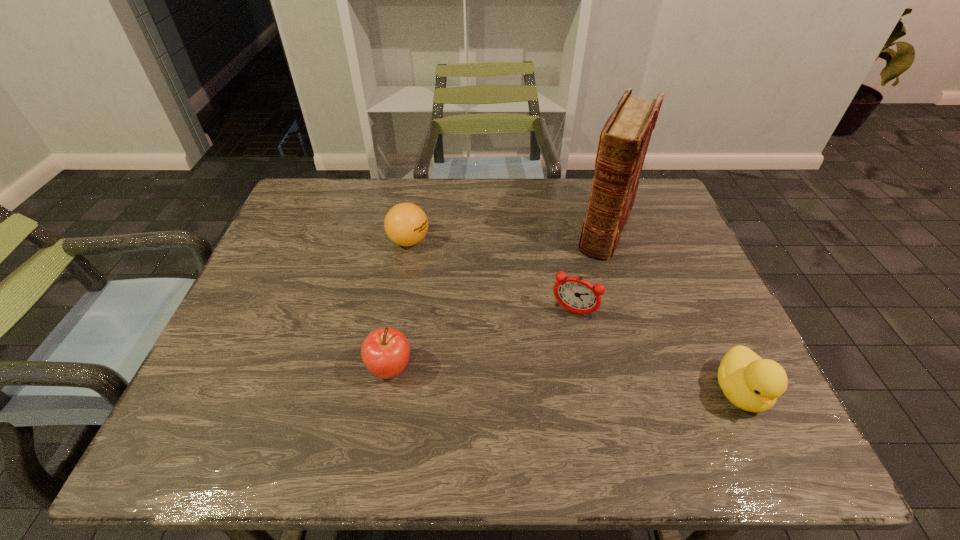
Locate an element on the screen. This screenshot has width=960, height=540. apple is located at coordinates (385, 352).

Locate an element on the screen. duck is located at coordinates (751, 383).

Find the location of a particular element. This screenshot has height=540, width=960. ping-pong ball is located at coordinates (406, 224).

This screenshot has width=960, height=540. What are the coordinates of `the tallest object` in the screenshot? It's located at (624, 139).

What are the coordinates of `the third nearest object` in the screenshot? It's located at (576, 295).

Where is `vacant space situated on the left of the apple`? Image resolution: width=960 pixels, height=540 pixels. vacant space situated on the left of the apple is located at coordinates (294, 369).

At what (x,y) coordinates should I click in order to perform the action: click on free space located 0.190m on the side with brand of the ping-pong ball. Please return your answer as a coordinate pair (x, y). This screenshot has height=540, width=960. Looking at the image, I should click on (464, 289).

This screenshot has width=960, height=540. Identify the location of vacant space located on the side with brand of the ping-pong ball. [495, 317].

Locate an element on the screen. This screenshot has height=540, width=960. vacant area situated 0.130m on the side with brand of the ping-pong ball is located at coordinates (449, 277).

Find the location of a particular element. The width and height of the screenshot is (960, 540). blank area located on the spine side of the hardback book is located at coordinates (586, 291).